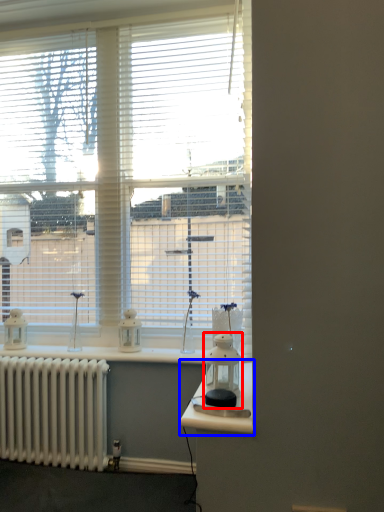
Question: Which object appears farthest to the camera in this image, appliance (highlighted by a red box) or table (highlighted by a blue box)?

Choices:
 (A) appliance
 (B) table

Answer: (A)